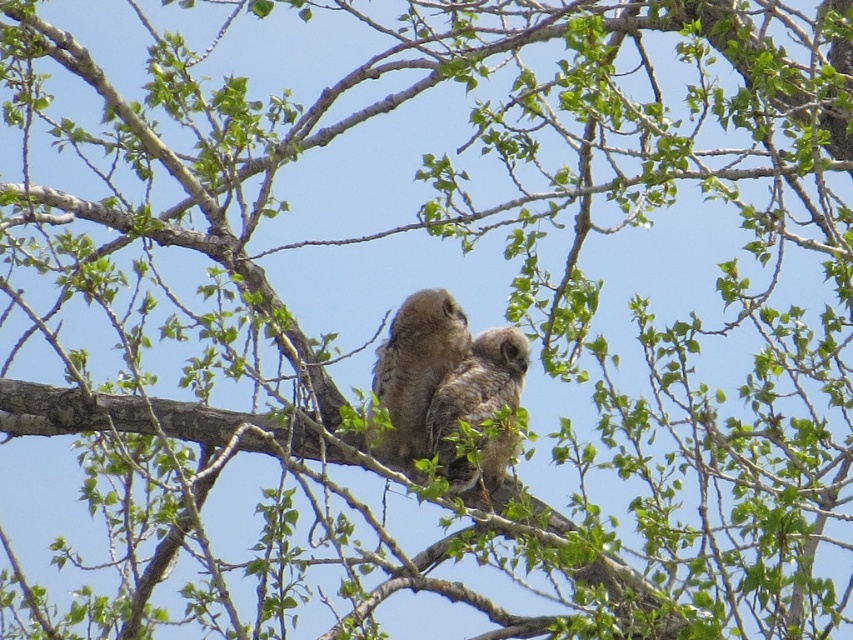
You are a birdwatcher observing two owls on a tree branch. You see the brown fuzzy owl at center and the brown fluffy owl at center. Which owl appears closer to you?

The brown fuzzy owl at center appears closer to you because it is positioned further to the viewer than the brown fluffy owl at center.

You are an ornithologist observing two points on the image of the two young owls. The points are labeled as point (386, 440) and point (448, 483). Based on their positions, which point is closer to the viewer?

Point (448, 483) is closer to the viewer because the point (386, 440) is behind it.

You are standing in a forest clearing and see two young owls perched on a tree branch. The coordinates of the point where the owls are located are point (x=381, y=342). If you want to observe them from a safe distance without disturbing them, what is the minimum distance you should maintain?

The minimum distance you should maintain is 4.32 meters, as the owls are located at point (x=381, y=342), which is 4.32 meters away from the viewer.